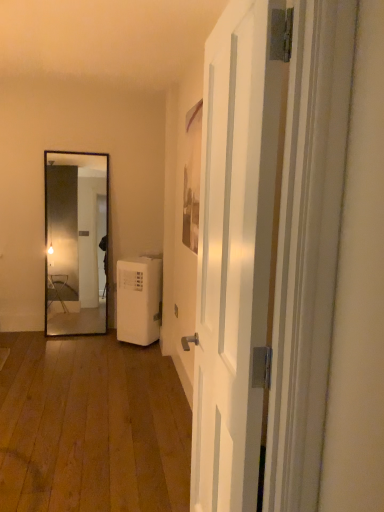
Locate an element on the screen. The width and height of the screenshot is (384, 512). vacant space that is to the left of white plastic water heater at lower center is located at coordinates (89, 339).